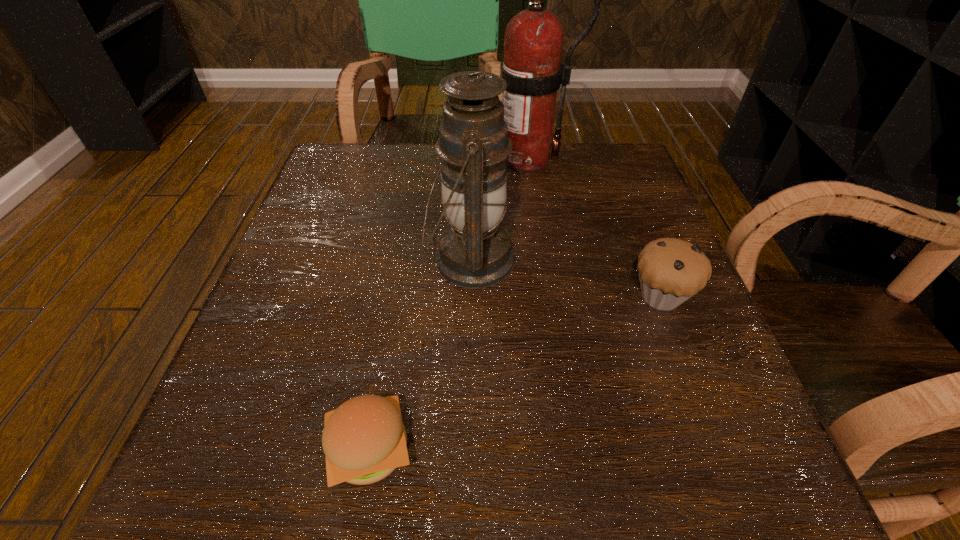
Image resolution: width=960 pixels, height=540 pixels. I want to click on vacant point located on the left of the oil lamp, so click(x=377, y=260).

This screenshot has width=960, height=540. Identify the location of vacant space situated on the left of the muffin. (450, 296).

Locate an element on the screen. The height and width of the screenshot is (540, 960). free spot located on the right of the nearest object is located at coordinates (729, 449).

Where is `object that is at the far edge`? The image size is (960, 540). object that is at the far edge is located at coordinates (531, 66).

This screenshot has width=960, height=540. Identify the location of object positioned at the near edge. [x=364, y=440].

Locate an element on the screen. The width and height of the screenshot is (960, 540). fire extinguisher that is positioned at the right edge is located at coordinates (531, 66).

I want to click on muffin that is at the right edge, so click(x=671, y=270).

Identify the location of object situated at the far right corner. (531, 66).

Identify the location of vacant region at the far edge of the desktop. (544, 193).

The width and height of the screenshot is (960, 540). What are the coordinates of `free spot at the near edge of the desktop` in the screenshot? It's located at (418, 468).